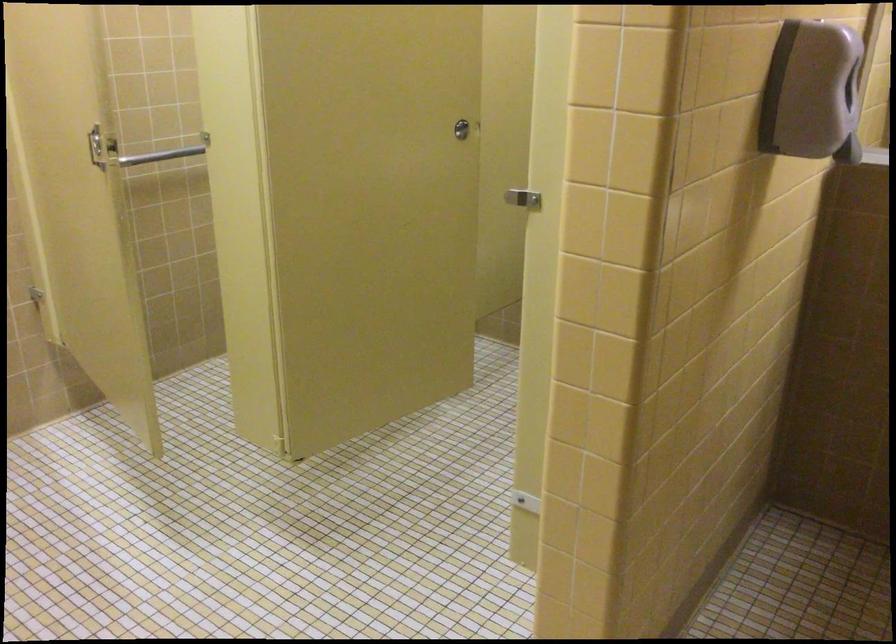
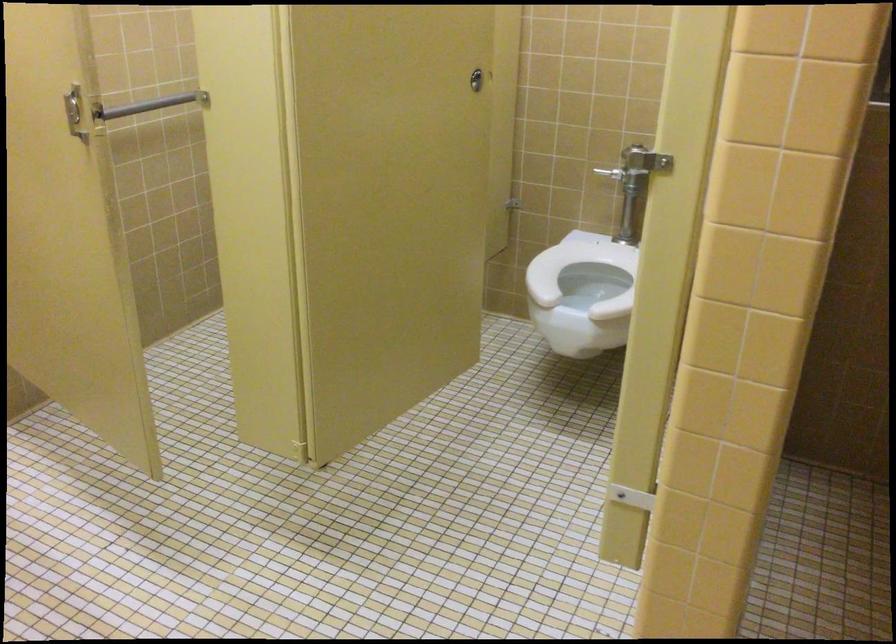
Locate, in the second image, the point that corresponds to point 96,149 in the first image.

(74, 111)